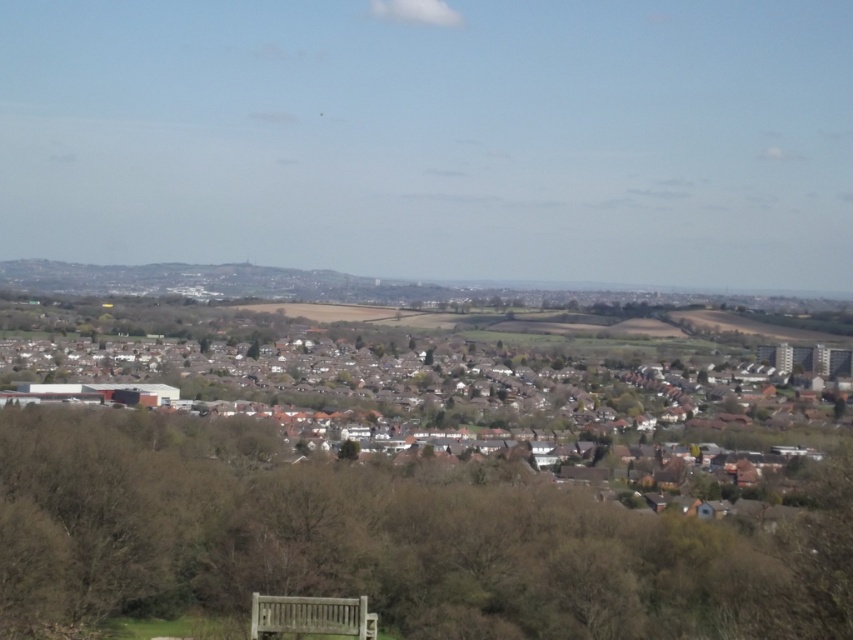
From the picture: You are standing at the viewpoint overlooking the suburban area. You see the white matte houses at center and the wooden bench at lower center. Which object is positioned to the left when viewed from your perspective?

The white matte houses at center is to the left of the wooden bench at lower center, so it is positioned to the left when viewed from your perspective.

You are standing at the top of a hill overlooking a suburban area. You see white matte houses at center. Based on their position, which direction would you need to look to find them?

The white matte houses at center are located at point coordinates of (426, 385), so you should look towards the center of the image to find them.

You are a park maintenance worker who needs to move a 1.5 meter wide equipment cart from the brown textured bench at lower center to the wooden bench at lower center. Given the distance between them is 15.26 meters, will you be able to navigate the cart through the path between them without any obstacles?

The distance between the brown textured bench at lower center and the wooden bench at lower center is 15.26 meters. Since the cart is only 1.5 meters wide, the 15.26 meter gap is more than sufficient for the cart to pass through without any issues.